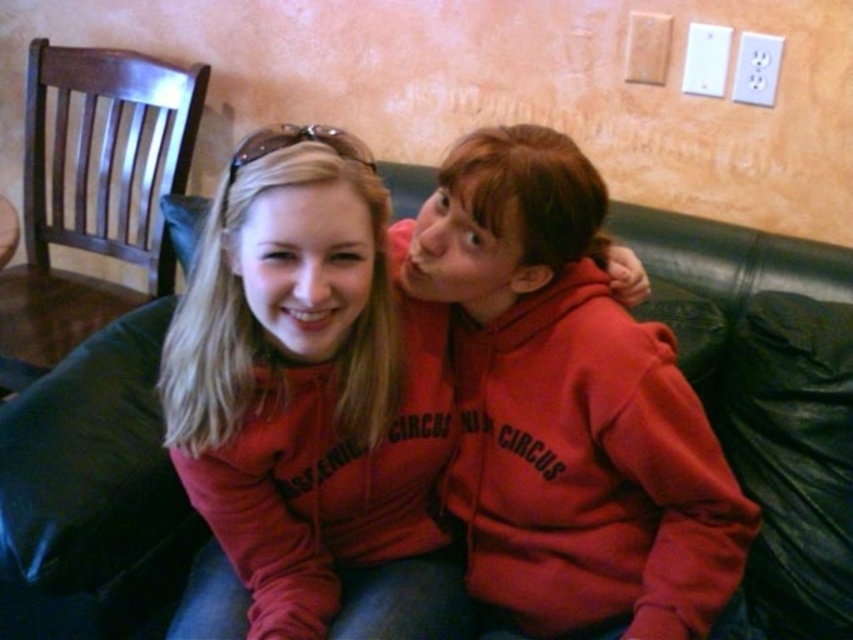
You are a photographer setting up for a portrait session. You notice the black leather couch at center and the matte red hoodie at center in the frame. Which object is closer to you, the photographer, according to the scene?

The black leather couch at center is closer to you than the matte red hoodie at center, so the couch is the object nearer to the photographer.

You are a photographer adjusting your camera settings. You notice two points in the image at coordinates point (704, 230) and point (589, 524). Which point is closer to the camera lens?

Point (704, 230) is further to the camera than point (589, 524), so the closer point to the camera lens is point (589, 524).

You are a delivery person trying to place a package on the couch. The package is 60 centimeters long. Based on the scene, will the package fit horizontally on the black leather couch at center without overlapping the matte red sweatshirt at center?

The distance between the black leather couch at center and matte red sweatshirt at center is 59.94 centimeters. Since the package is 60 centimeters long, it will not fit without overlapping the matte red sweatshirt at center.